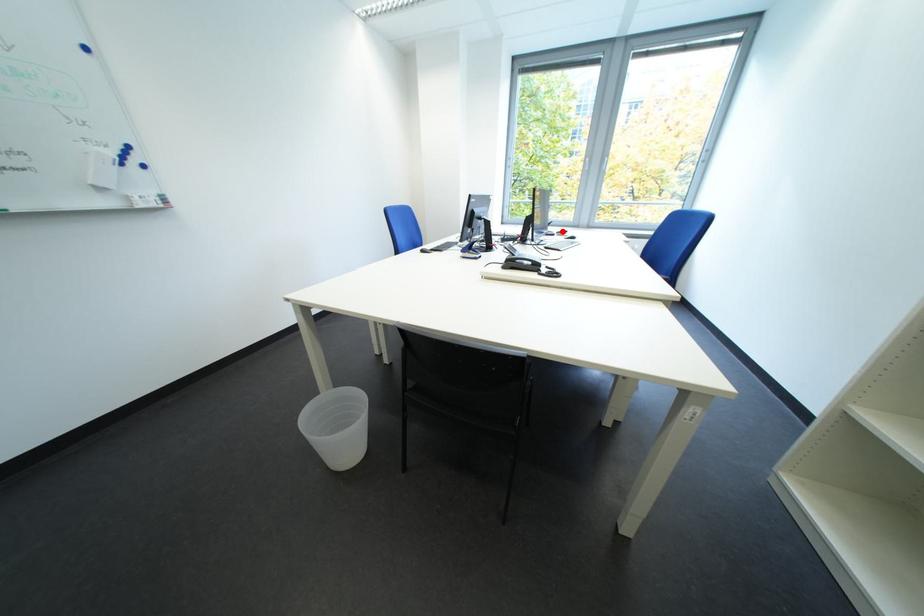
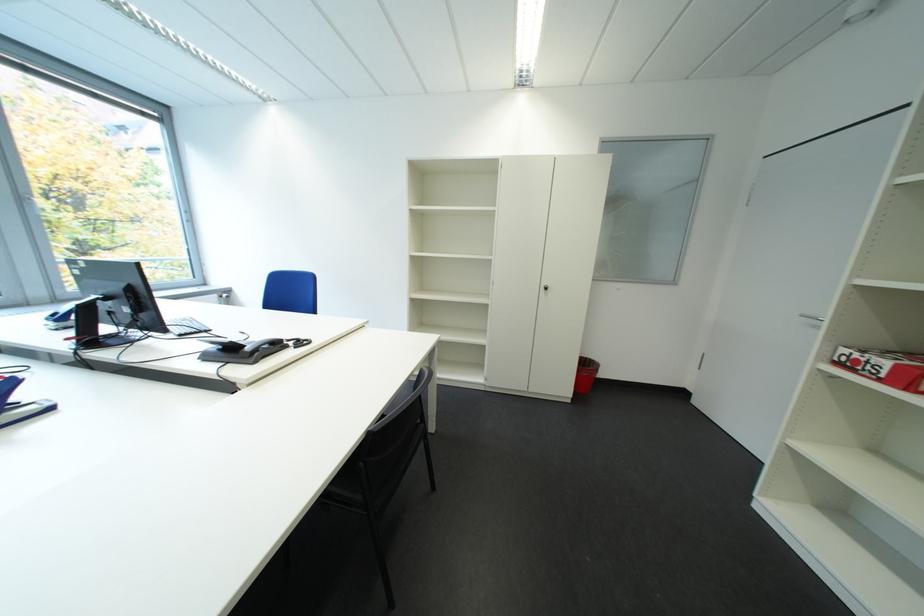
Question: I am providing you with two images of the same scene from different viewpoints. A red point is marked on the first image. At the location where the point appears in image 1, is it still visible in image 2?

Choices:
 (A) Yes
 (B) No

Answer: (B)